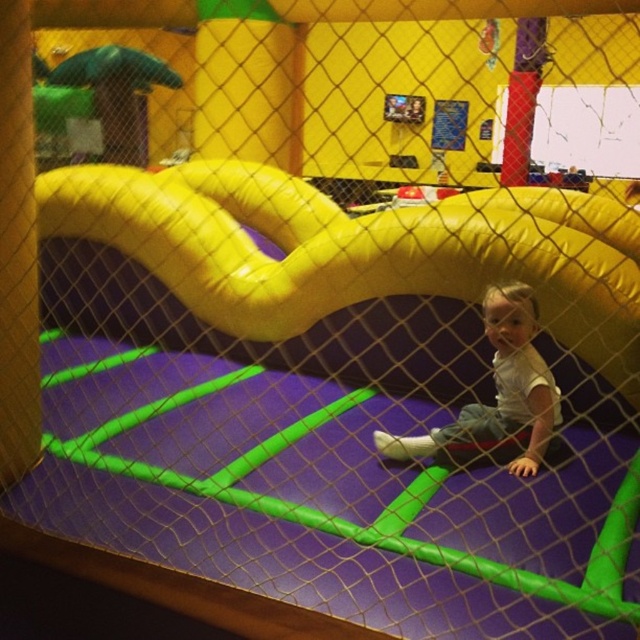
You are a parent trying to decide if your child can easily reach the yellow inflatable slide at center from where they are sitting on the white matte shirt at center. Based on their sizes, can the child reach the slide without needing to move much?

The yellow inflatable slide at center is bigger than the white matte shirt at center, so the child can easily reach the slide without needing to move much since the slide is larger and closer in proximity.

You are a parent trying to locate your child in the play area. You see the yellow inflatable slide at center and the white matte shirt at center. Which object is located to the left of the other?

The yellow inflatable slide at center is positioned on the left side of white matte shirt at center.

You are standing at the entrance of the play area and see the point marked at coordinates (340, 278). What object does this point correspond to?

The point at coordinates (340, 278) corresponds to the yellow inflatable slide at center.